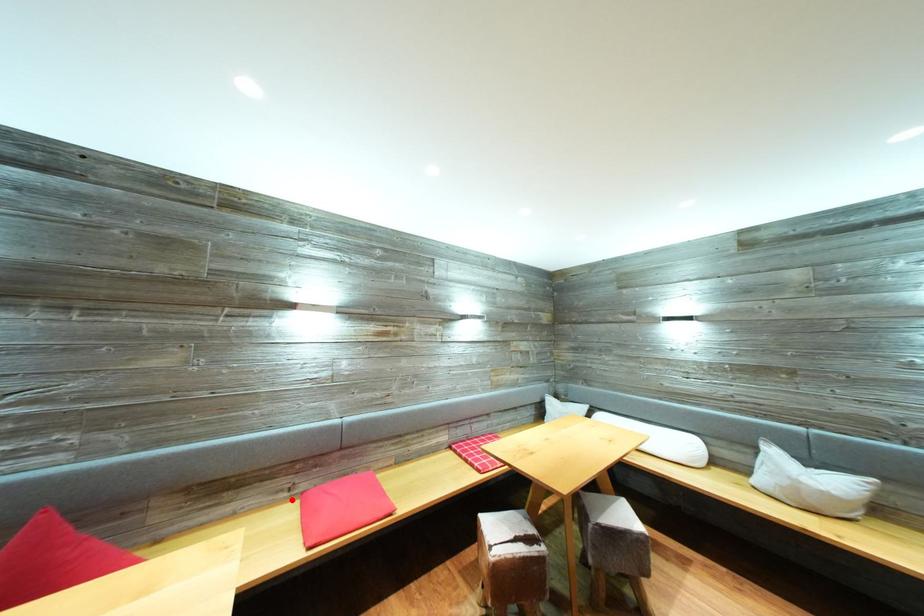
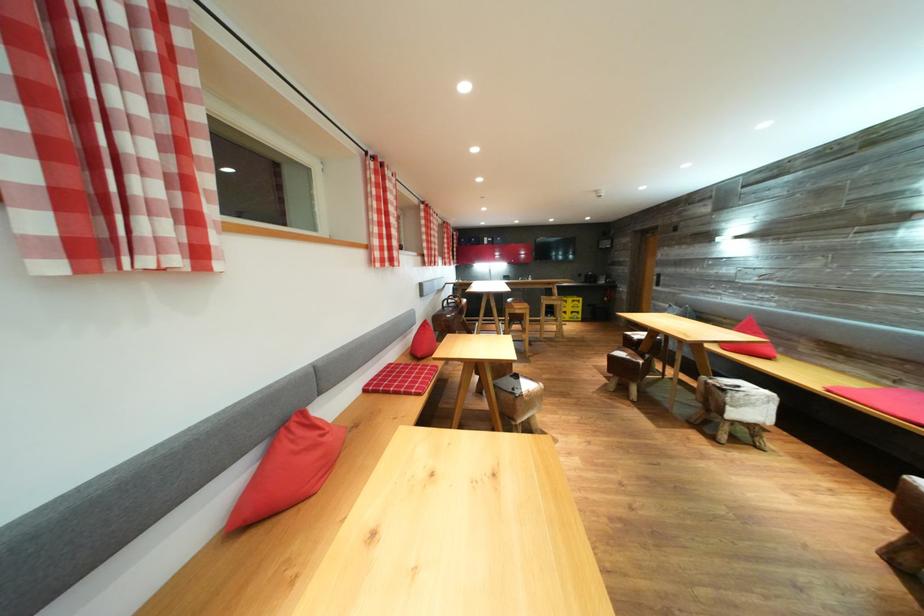
Question: I am providing you with two images of the same scene from different viewpoints. A red point is shown in image1. For the corresponding object point in image2, is it positioned nearer or farther from the camera?

Choices:
 (A) Nearer
 (B) Farther

Answer: (B)